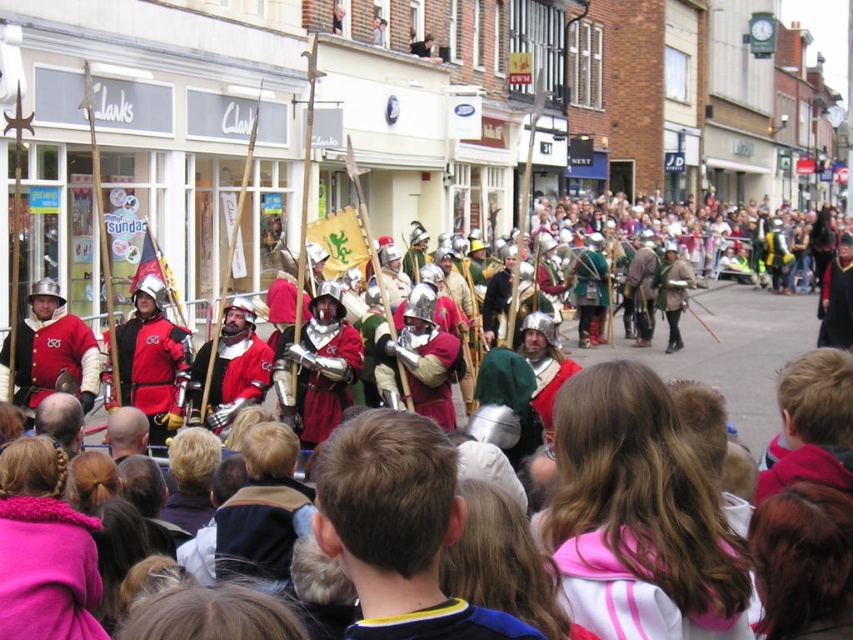
Question: Can you confirm if matte red tunic at center is bigger than shiny silver armor at center?

Choices:
 (A) no
 (B) yes

Answer: (A)

Question: Which point is closer to the camera?

Choices:
 (A) (401, 513)
 (B) (630, 280)
 (C) (51, 326)

Answer: (A)

Question: Is matte red tunic at center wider than shiny silver armor at center?

Choices:
 (A) no
 (B) yes

Answer: (A)

Question: Among these objects, which one is farthest from the camera?

Choices:
 (A) shiny silver armor at center
 (B) dark brown hair at center

Answer: (A)

Question: Does pink fabric jacket at center appear over shiny silver armor at center?

Choices:
 (A) yes
 (B) no

Answer: (B)

Question: Which object is the farthest from the matte red tunic at center?

Choices:
 (A) dark brown hair at center
 (B) shiny silver armor at center

Answer: (B)